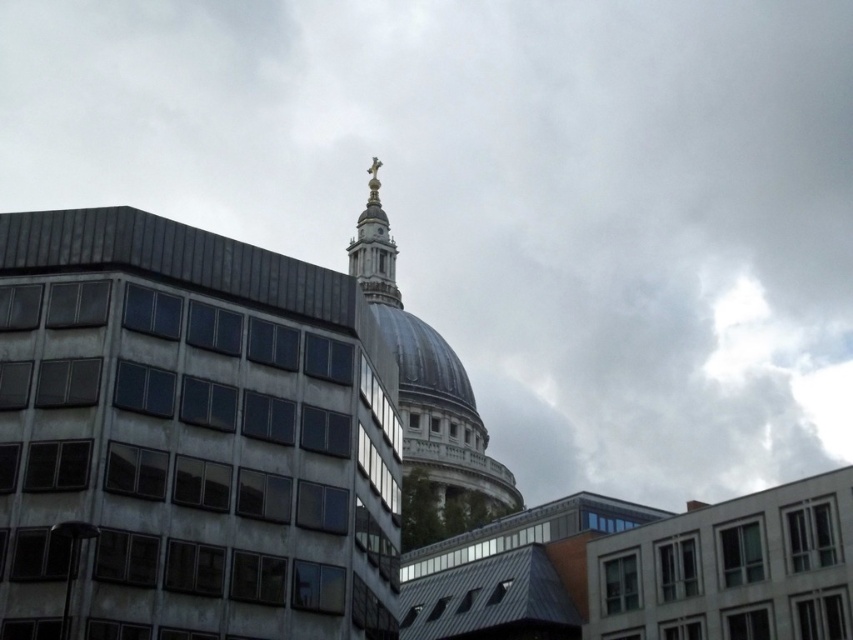
Does gold metallic spire at upper center appear on the left side of gold polished metal spire at upper center?

No, gold metallic spire at upper center is not to the left of gold polished metal spire at upper center.

This screenshot has height=640, width=853. Find the location of `gold metallic spire at upper center`. gold metallic spire at upper center is located at coordinates (189, 436).

Who is more distant from viewer, [286,600] or [376,180]?

The point [376,180] is more distant.

I want to click on gold metallic spire at upper center, so click(189, 436).

Between gold metallic spire at upper center and shiny metallic dome at center, which one has less height?

shiny metallic dome at center is shorter.

Which is in front, point (103, 300) or point (427, 342)?

Point (103, 300) is more forward.

Image resolution: width=853 pixels, height=640 pixels. I want to click on gold metallic spire at upper center, so click(x=189, y=436).

Which is more to the right, white marble dome at center or shiny metallic dome at center?

white marble dome at center is more to the right.

From the picture: Who is taller, white marble dome at center or shiny metallic dome at center?

white marble dome at center

Which is in front, point (422, 371) or point (407, 384)?

Positioned in front is point (407, 384).

Where is `white marble dome at center`? The height and width of the screenshot is (640, 853). white marble dome at center is located at coordinates (428, 403).